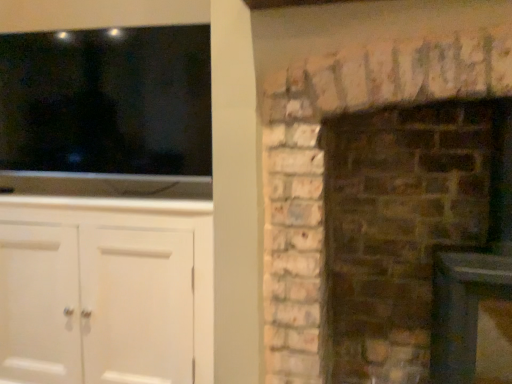
Question: Is white painted wood cabinet at left at the right side of black glossy tv at upper left?

Choices:
 (A) no
 (B) yes

Answer: (B)

Question: From a real-world perspective, is white painted wood cabinet at left on black glossy tv at upper left?

Choices:
 (A) yes
 (B) no

Answer: (B)

Question: Does white painted wood cabinet at left have a greater height compared to black glossy tv at upper left?

Choices:
 (A) yes
 (B) no

Answer: (A)

Question: Is white painted wood cabinet at left next to black glossy tv at upper left and touching it?

Choices:
 (A) no
 (B) yes

Answer: (A)

Question: Considering the relative sizes of white painted wood cabinet at left and black glossy tv at upper left in the image provided, is white painted wood cabinet at left bigger than black glossy tv at upper left?

Choices:
 (A) yes
 (B) no

Answer: (A)

Question: Is white painted wood cabinet at left looking in the opposite direction of black glossy tv at upper left?

Choices:
 (A) no
 (B) yes

Answer: (A)

Question: From a real-world perspective, is black glossy tv at upper left located higher than white painted wood cabinet at left?

Choices:
 (A) yes
 (B) no

Answer: (A)

Question: Is black glossy tv at upper left directly adjacent to white painted wood cabinet at left?

Choices:
 (A) no
 (B) yes

Answer: (A)

Question: Are black glossy tv at upper left and white painted wood cabinet at left located far from each other?

Choices:
 (A) no
 (B) yes

Answer: (A)

Question: Does black glossy tv at upper left have a lesser width compared to white painted wood cabinet at left?

Choices:
 (A) yes
 (B) no

Answer: (A)

Question: Could you tell me if black glossy tv at upper left is facing white painted wood cabinet at left?

Choices:
 (A) no
 (B) yes

Answer: (A)

Question: Does black glossy tv at upper left come in front of white painted wood cabinet at left?

Choices:
 (A) yes
 (B) no

Answer: (B)

Question: Considering the relative sizes of brown brick fireplace at right and white painted wood cabinet at left in the image provided, is brown brick fireplace at right thinner than white painted wood cabinet at left?

Choices:
 (A) no
 (B) yes

Answer: (A)